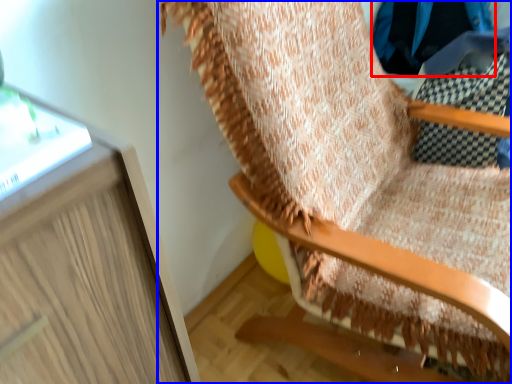
Question: Which point is closer to the camera, clothing (highlighted by a red box) or furniture (highlighted by a blue box)?

Choices:
 (A) clothing
 (B) furniture

Answer: (B)